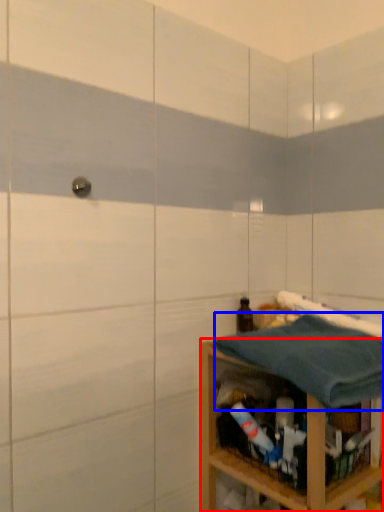
Question: Which point is closer to the camera, shelf (highlighted by a red box) or bath towel (highlighted by a blue box)?

Choices:
 (A) shelf
 (B) bath towel

Answer: (B)